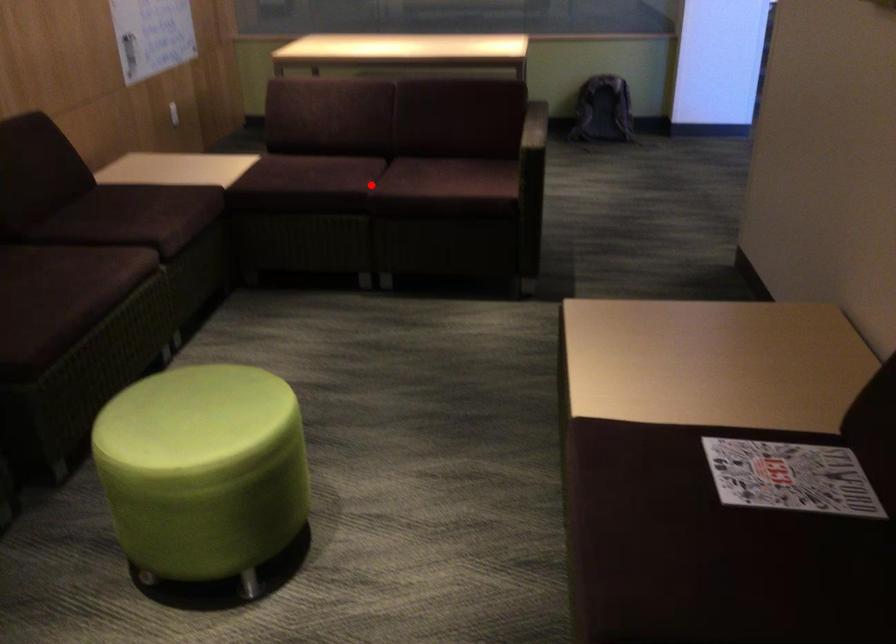
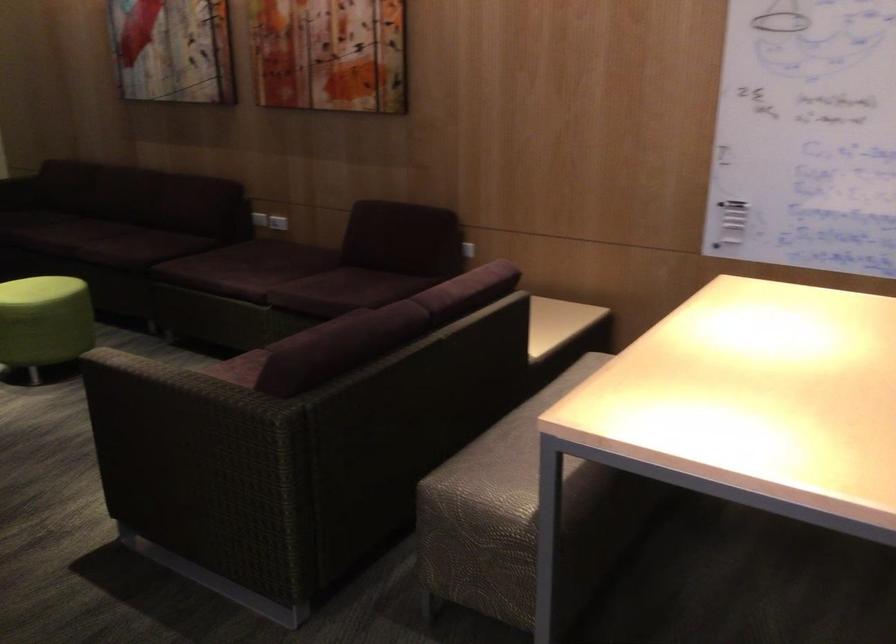
Question: I am providing you with two images of the same scene from different viewpoints. A red point is marked on the first image. Can you still see the location of the red point in image 2?

Choices:
 (A) Yes
 (B) No

Answer: (B)